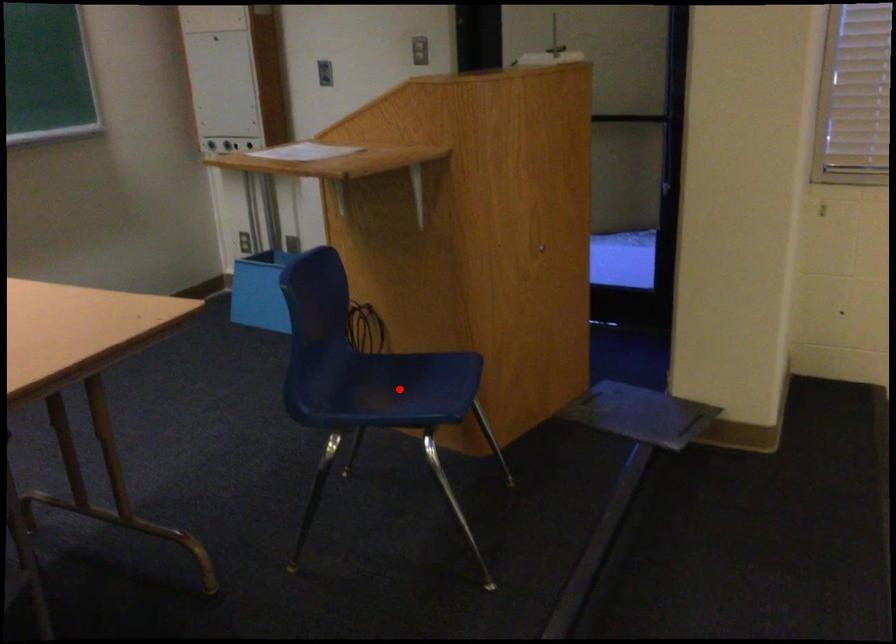
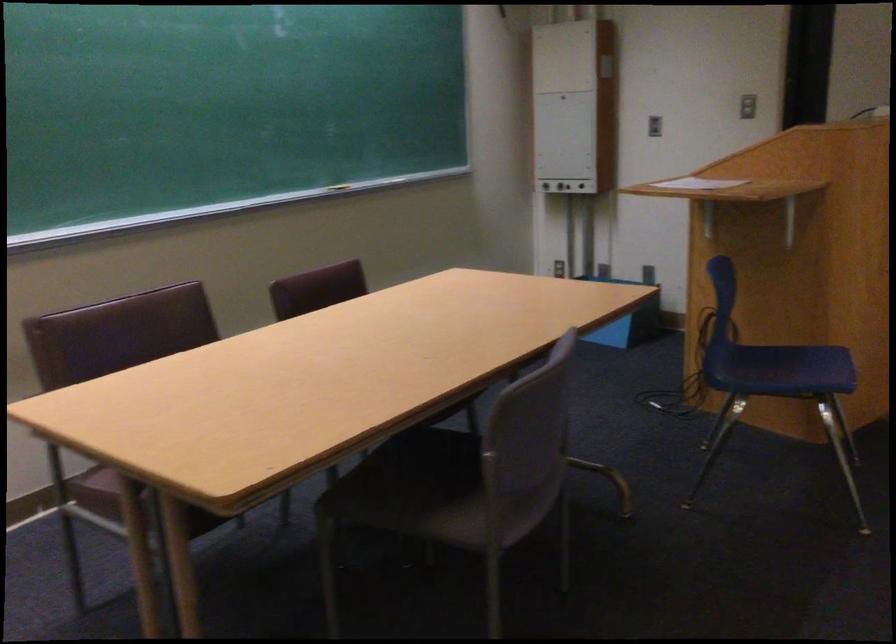
Question: I am providing you with two images of the same scene from different viewpoints. Image1 has a red point marked. In image2, the corresponding 3D location appears at what relative position? Reply with the corresponding letter.

Choices:
 (A) Closer
 (B) Farther

Answer: (B)